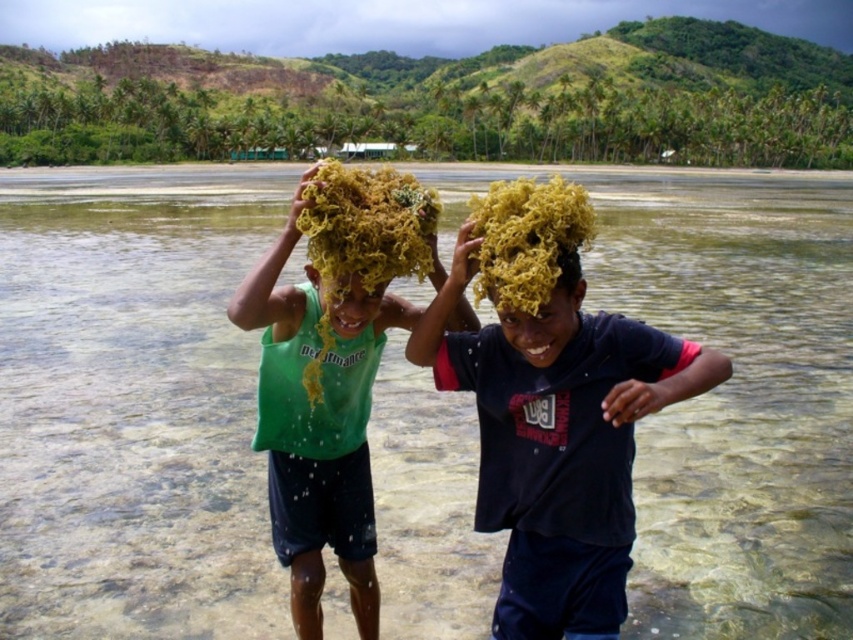
Question: Which object is positioned closest to the yellow seaweed at center?

Choices:
 (A) green matte seaweed at center
 (B) clear water at center

Answer: (A)

Question: Which point is farther from the camera taking this photo?

Choices:
 (A) 527,236
 (B) 270,506
 (C) 234,596

Answer: (C)

Question: Where is matte yellow seaweed at center located in relation to yellow curly hair at center in the image?

Choices:
 (A) left
 (B) right

Answer: (A)

Question: From the image, what is the correct spatial relationship of matte yellow seaweed at center in relation to green matte seaweed at center?

Choices:
 (A) left
 (B) right

Answer: (B)

Question: Can you confirm if matte yellow seaweed at center is positioned above green matte seaweed at center?

Choices:
 (A) no
 (B) yes

Answer: (B)

Question: Which of the following is the closest to the observer?

Choices:
 (A) yellow curly hair at center
 (B) green matte seaweed at center
 (C) clear water at center
 (D) matte yellow seaweed at center

Answer: (D)